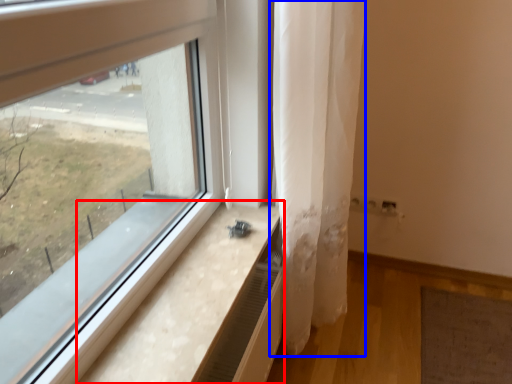
Question: Which of the following is the closest to the observer, window sill (highlighted by a red box) or curtain (highlighted by a blue box)?

Choices:
 (A) window sill
 (B) curtain

Answer: (A)